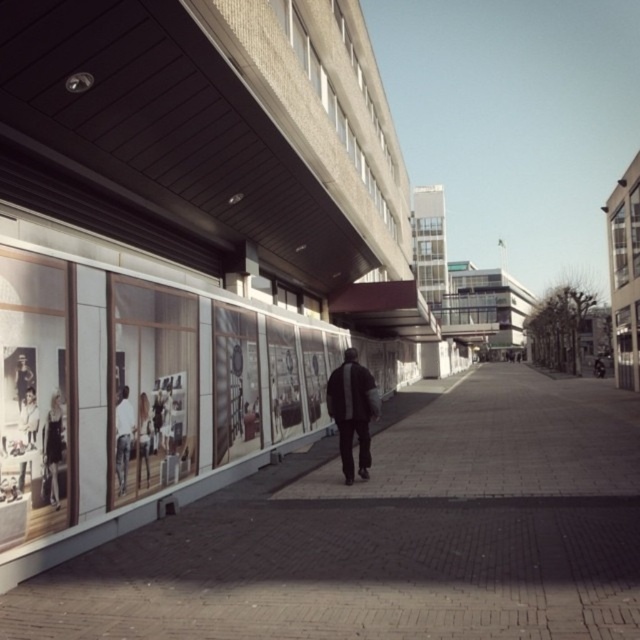
You are standing on the pedestrian walkway in the urban street scene. There are two points marked on the ground ahead of you. The first point is at coordinates point (52, 448) and the second is at point (22, 460). Which point is closer to your current position?

Point (52, 448) is closer to your current position because it is further to the viewer than point (22, 460).

In the scene shown: You are a photographer standing on the pedestrian walkway and want to take a photo of the matte black jacket at left and the white fabric at left. Which object is closer to the left edge of your camera frame?

The matte black jacket at left is positioned on the left side of the white fabric at left, so it is closer to the left edge of the camera frame.